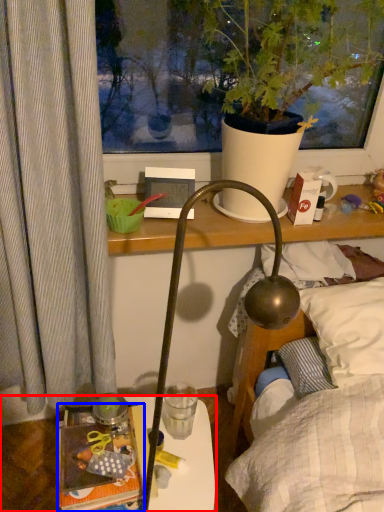
Question: Which object appears closest to the camera in this image, table (highlighted by a red box) or book (highlighted by a blue box)?

Choices:
 (A) table
 (B) book

Answer: (B)